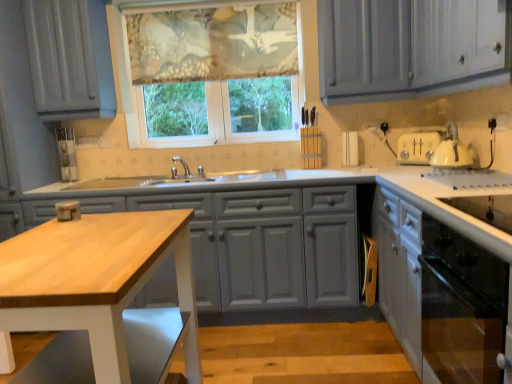
Locate an element on the screen. This screenshot has width=512, height=384. free space above white glossy cabinet at lower right, which appears as the 2th cabinetry when viewed from the left (from a real-world perspective) is located at coordinates (453, 178).